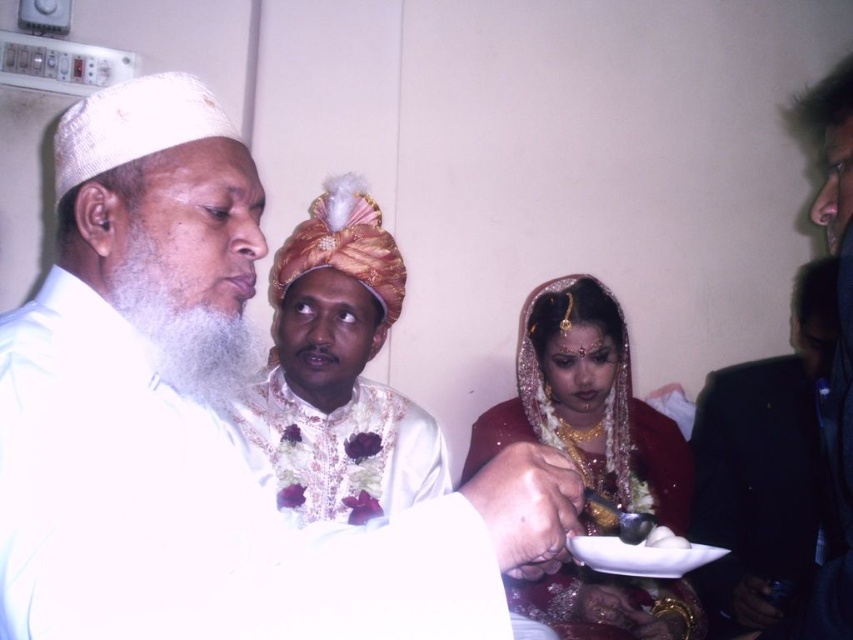
You are a guest at this ceremony and need to place a small gift on the table. The gift requires more space than the white glossy rice at lower center. Can the matte gold jewelry at center provide enough space for your gift?

The matte gold jewelry at center is wider than the white glossy rice at lower center, so it can provide enough space for your gift.

In the scene of a traditional ceremony, there is a man wearing a white satin turban at center and holding white glossy rice at lower center. Which object is taller?

The white satin turban at center is much taller than the white glossy rice at lower center.

You are standing at the point marked as point (283, 285) and want to move to the point marked as point (677, 538). Given that you can only move forward in a straight line, will you be able to reach the destination without changing direction?

Since point (283, 285) is behind point (677, 538), you cannot move forward in a straight line from point (283, 285) to point (677, 538) without changing direction because the destination is behind your starting position.